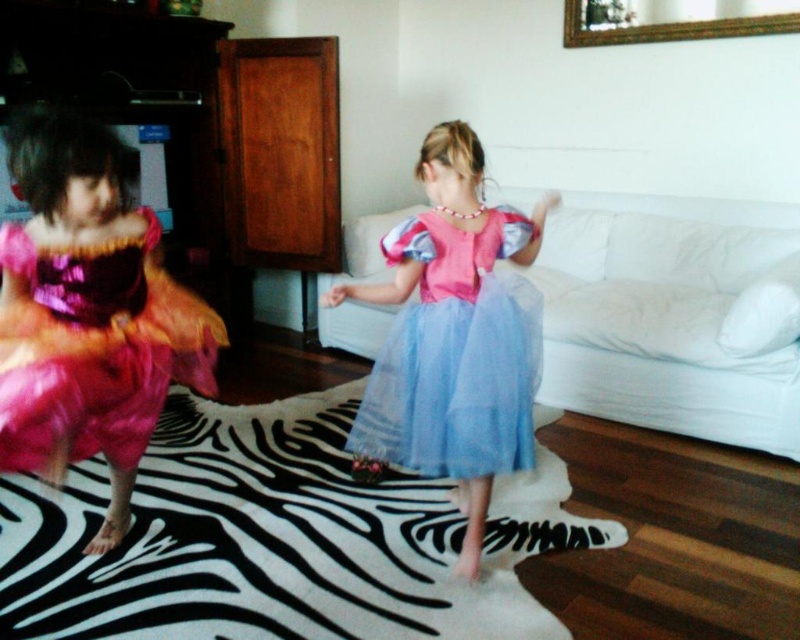
You are standing in the living room and want to reach a point marked at coordinates (84,371). If your current position is 1.5 meters away from the camera, how much further do you need to move forward to reach that point?

The point at coordinates (84,371) is 1.81 meters away from the camera. Since you are currently 1.5 meters away from the camera, you need to move forward an additional 0.31 meters to reach that point.

You are standing in the living room and see two points marked on the floor. One is at point (421, 348) and the other at point (96, 352). If you want to step on both points in order from closest to farthest from you, which point should you step on first?

You should step on point (96, 352) first because it is closer to you than point (421, 348), which is further away.

You are a photographer setting up a camera in the living room to capture both the shiny blue tulle dress at center and the shiny pink dress at left. The camera has a limited field of view. Based on their positions and sizes, which dress might require you to adjust your camera angle to ensure it fits in the frame?

The shiny blue tulle dress at center might require adjusting the camera angle because it might be wider than the shiny pink dress at left, so it could take up more space in the frame.